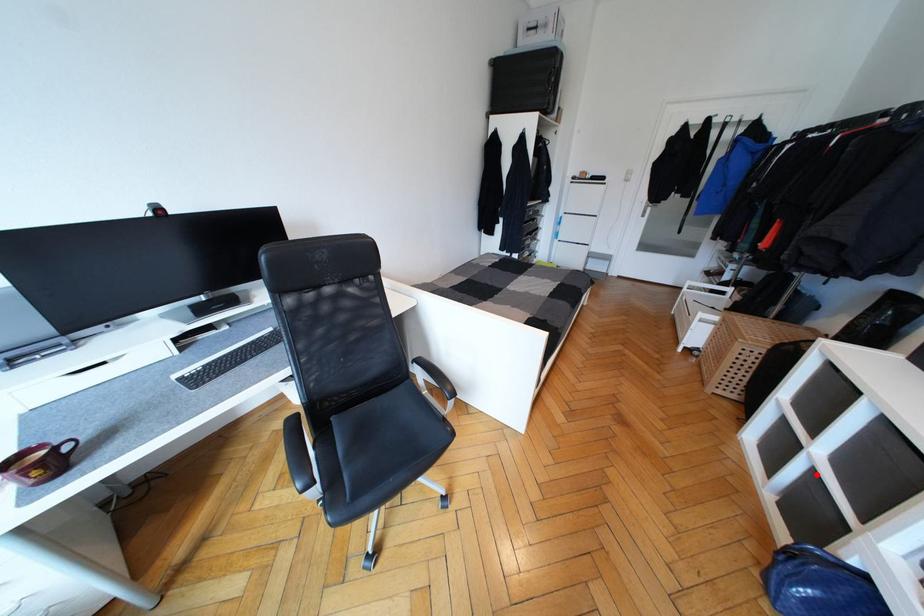
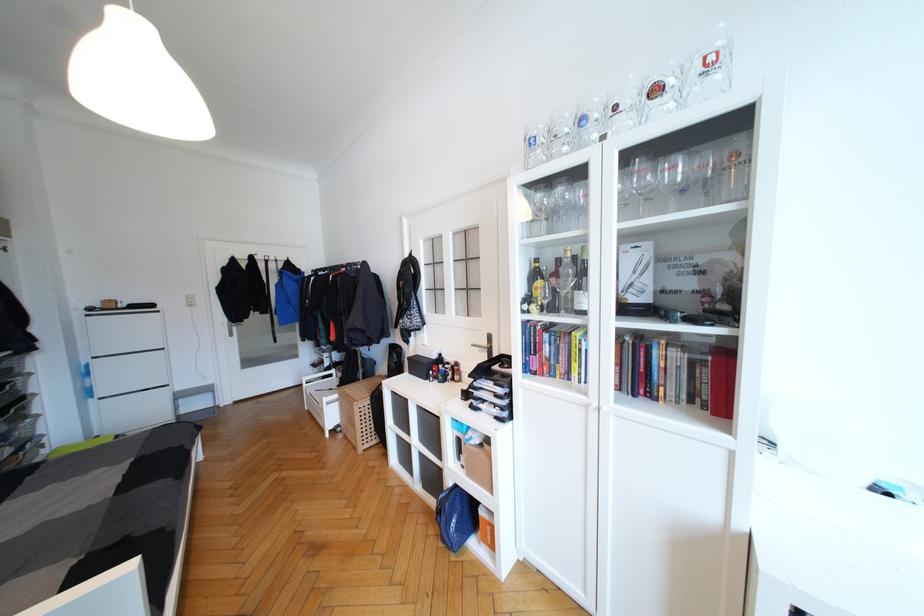
Question: I am providing you with two images of the same scene from different viewpoints. A red point is shown in image1. For the corresponding object point in image2, is it positioned nearer or farther from the camera?

Choices:
 (A) Nearer
 (B) Farther

Answer: (B)